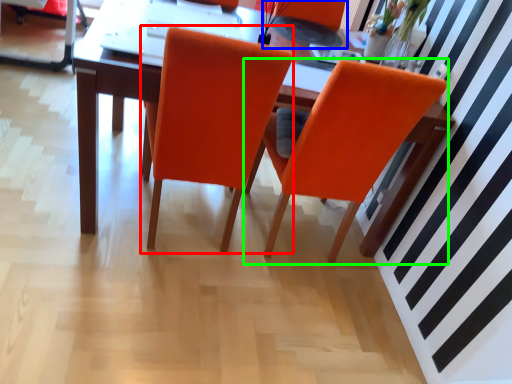
Question: Which object is positioned closest to chair (highlighted by a red box)? Select from armchair (highlighted by a blue box) and chair (highlighted by a green box).

Choices:
 (A) armchair
 (B) chair

Answer: (B)